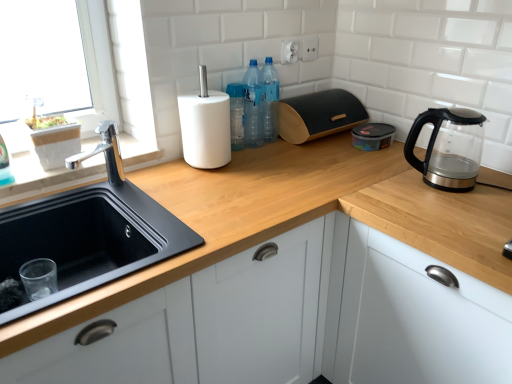
I want to click on wooden at upper center, so click(x=228, y=214).

What do you see at coordinates (253, 107) in the screenshot? Image resolution: width=512 pixels, height=384 pixels. I see `translucent plastic bottles at center, acting as the first bottle starting from the left` at bounding box center [253, 107].

Identify the location of transparent glass kettle at right. (448, 149).

Describe the element at coordinates (104, 153) in the screenshot. I see `chrome metallic faucet at left` at that location.

The width and height of the screenshot is (512, 384). Identify the location of black wood bread bin at upper center. (319, 115).

What are the coordinates of `black plastic container at upper center` in the screenshot? It's located at (372, 136).

Where is `wooden at upper center`? This screenshot has height=384, width=512. wooden at upper center is located at coordinates (228, 214).

From the image's perspective, is white matte cabinet at lower right on top of black plastic container at upper center?

No.

From a real-world perspective, between white matte cabinet at lower right and black plastic container at upper center, who is vertically lower?

white matte cabinet at lower right.

Who is smaller, white matte cabinet at lower right or black plastic container at upper center?

Smaller between the two is black plastic container at upper center.

Based on the photo, does white matte cabinet at lower right turn towards black plastic container at upper center?

No.

Is black wood bread bin at upper center spatially inside chrome metallic faucet at left, or outside of it?

black wood bread bin at upper center is not enclosed by chrome metallic faucet at left.

How far apart are black wood bread bin at upper center and chrome metallic faucet at left?

A distance of 30.50 inches exists between black wood bread bin at upper center and chrome metallic faucet at left.

Which object is positioned more to the left, black wood bread bin at upper center or chrome metallic faucet at left?

From the viewer's perspective, chrome metallic faucet at left appears more on the left side.

I want to click on appliance to the right of chrome metallic faucet at left, so click(319, 115).

From the image's perspective, which object appears higher, translucent plastic bottles at center, arranged as the second bottle when viewed from the right, or chrome metallic faucet at left?

translucent plastic bottles at center, arranged as the second bottle when viewed from the right, appears higher in the image.

Which object is more forward, translucent plastic bottles at center, arranged as the second bottle when viewed from the right, or chrome metallic faucet at left?

chrome metallic faucet at left is closer to the camera.

Is translucent plastic bottles at center, acting as the first bottle starting from the left, positioned beyond the bounds of chrome metallic faucet at left?

Yes, translucent plastic bottles at center, acting as the first bottle starting from the left, is not within chrome metallic faucet at left.

In the scene shown: Does translucent plastic bottles at center, acting as the first bottle starting from the left, have a greater width compared to transparent glass kettle at right?

In fact, translucent plastic bottles at center, acting as the first bottle starting from the left, might be narrower than transparent glass kettle at right.

From the image's perspective, would you say translucent plastic bottles at center, acting as the first bottle starting from the left, is shown under transparent glass kettle at right?

No, from the image's perspective, translucent plastic bottles at center, acting as the first bottle starting from the left, is not below transparent glass kettle at right.

Is transparent glass kettle at right surrounded by translucent plastic bottles at center, arranged as the second bottle when viewed from the right?

No, transparent glass kettle at right is not inside translucent plastic bottles at center, arranged as the second bottle when viewed from the right.

Could you measure the distance between translucent plastic bottles at center, acting as the first bottle starting from the left, and transparent glass kettle at right?

translucent plastic bottles at center, acting as the first bottle starting from the left, and transparent glass kettle at right are 26.41 inches apart from each other.

Does black plastic container at upper center contain black wood bread bin at upper center?

Definitely not — black wood bread bin at upper center is not inside black plastic container at upper center.

Considering the relative positions of black plastic container at upper center and black wood bread bin at upper center in the image provided, is black plastic container at upper center to the right of black wood bread bin at upper center from the viewer's perspective?

Yes.

Which is in front, black plastic container at upper center or black wood bread bin at upper center?

black wood bread bin at upper center is more forward.

Does black matte sink at lower left have a lesser width compared to translucent plastic bottles at center, acting as the first bottle starting from the left?

No, black matte sink at lower left is not thinner than translucent plastic bottles at center, acting as the first bottle starting from the left.

Which is more to the right, black matte sink at lower left or translucent plastic bottles at center, acting as the first bottle starting from the left?

From the viewer's perspective, translucent plastic bottles at center, acting as the first bottle starting from the left, appears more on the right side.

Where is `sink below the translucent plastic bottles at center, arranged as the second bottle when viewed from the right (from a real-world perspective)`? The image size is (512, 384). sink below the translucent plastic bottles at center, arranged as the second bottle when viewed from the right (from a real-world perspective) is located at coordinates (86, 235).

Does wooden at upper center have a lesser width compared to black matte sink at lower left?

No.

Is wooden at upper center at the left side of black matte sink at lower left?

No.

Looking at this image, considering the positions of objects wooden at upper center and black matte sink at lower left in the image provided, who is behind, wooden at upper center or black matte sink at lower left?

black matte sink at lower left is more distant.

I want to click on kitchen appliance behind the white matte cabinet at lower right, so click(x=372, y=136).

This screenshot has height=384, width=512. In order to click on appliance that is on the right side of chrome metallic faucet at left in this screenshot , I will do `click(319, 115)`.

Based on the photo, considering their positions, is chrome metallic faucet at left positioned closer to black plastic container at upper center than white matte cabinet at lower right?

The object closer to black plastic container at upper center is white matte cabinet at lower right.

Which object lies further to the anchor point wooden at upper center, black matte sink at lower left or black wood bread bin at upper center?

Among the two, black wood bread bin at upper center is located further to wooden at upper center.

Looking at the image, which one is located closer to black wood bread bin at upper center, white matte cabinet at lower right or chrome metallic faucet at left?

The object closer to black wood bread bin at upper center is white matte cabinet at lower right.

Considering their positions, is black wood bread bin at upper center positioned closer to wooden at upper center than translucent plastic bottles at center, acting as the first bottle starting from the left?

black wood bread bin at upper center is closer to wooden at upper center.

Looking at the image, which one is located closer to black plastic container at upper center, white matte cabinet at lower right or translucent plastic bottles at upper center, the second bottle in the left-to-right sequence?

translucent plastic bottles at upper center, the second bottle in the left-to-right sequence.

Looking at the image, which one is located closer to chrome metallic faucet at left, black matte sink at lower left or black plastic container at upper center?

black matte sink at lower left.

Based on their spatial positions, is translucent plastic bottles at center, arranged as the second bottle when viewed from the right, or black plastic container at upper center closer to black wood bread bin at upper center?

Among the two, black plastic container at upper center is located nearer to black wood bread bin at upper center.

When comparing their distances from translucent plastic bottles at upper center, which appears as the 1th bottle when viewed from the right, does wooden at upper center or black wood bread bin at upper center seem closer?

black wood bread bin at upper center is closer to translucent plastic bottles at upper center, which appears as the 1th bottle when viewed from the right.

Locate an element on the screen. home appliance between translucent plastic bottles at center, acting as the first bottle starting from the left, and white matte cabinet at lower right in the up-down direction is located at coordinates (448, 149).

Find the location of `home appliance located between white matte cabinet at lower right and black plastic container at upper center in the depth direction`. home appliance located between white matte cabinet at lower right and black plastic container at upper center in the depth direction is located at coordinates (448, 149).

Where is `counter top located between black matte sink at lower left and transparent glass kettle at right in the left-right direction`? This screenshot has width=512, height=384. counter top located between black matte sink at lower left and transparent glass kettle at right in the left-right direction is located at coordinates (228, 214).

The height and width of the screenshot is (384, 512). Find the location of `sink between chrome metallic faucet at left and black plastic container at upper center in the horizontal direction`. sink between chrome metallic faucet at left and black plastic container at upper center in the horizontal direction is located at coordinates (86, 235).